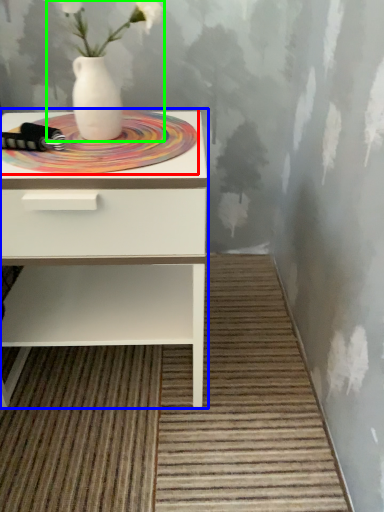
Question: Based on their relative distances, which object is nearer to mat (highlighted by a red box)? Choose from nightstand (highlighted by a blue box) and floral arrangement (highlighted by a green box).

Choices:
 (A) nightstand
 (B) floral arrangement

Answer: (B)